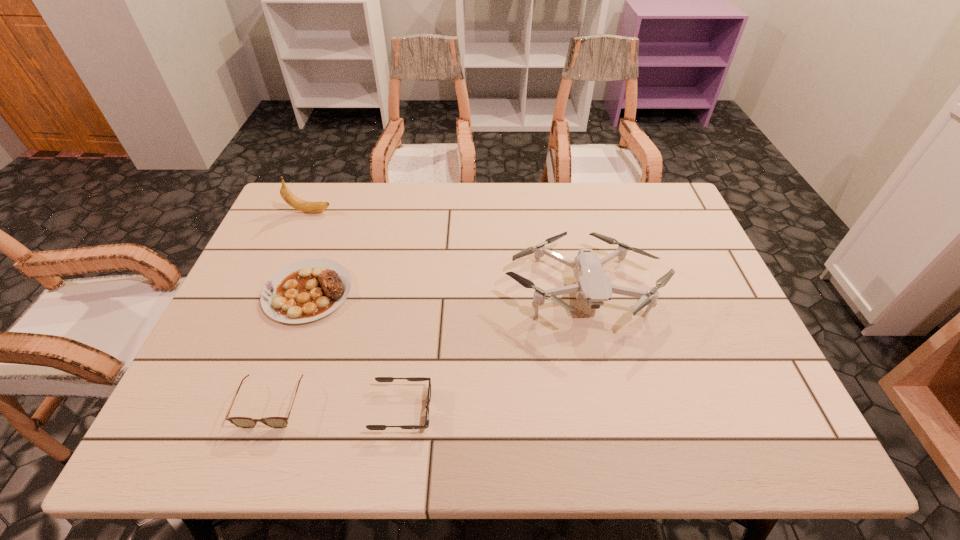
At what (x,y) coordinates should I click in order to perform the action: click on empty space that is in between the fourth shortest object and the second object from right to left. Please return your answer as a coordinate pair (x, y). Looking at the image, I should click on (492, 349).

The height and width of the screenshot is (540, 960). Identify the location of vacant point located between the spectacles and the steak. (290, 348).

Locate an element on the screen. The height and width of the screenshot is (540, 960). vacant area between the drone and the banana is located at coordinates (446, 250).

Where is `free spot between the shortest object and the drone`? Image resolution: width=960 pixels, height=540 pixels. free spot between the shortest object and the drone is located at coordinates (492, 349).

The width and height of the screenshot is (960, 540). What are the coordinates of `unoccupied area between the fourth shortest object and the spectacles` in the screenshot? It's located at (427, 347).

Identify the location of vacant region between the steak and the tallest object. (309, 252).

Identify which object is the fourth nearest to the shortest object. Please provide its 2D coordinates. Your answer should be formatted as a tuple, i.e. [(x, y)], where the tuple contains the x and y coordinates of a point satisfying the conditions above.

[(306, 206)]

The width and height of the screenshot is (960, 540). Find the location of `object that stands as the third closest to the tallest object`. object that stands as the third closest to the tallest object is located at coordinates (243, 422).

At what (x,y) coordinates should I click in order to perform the action: click on free space that satisfies the following two spatial constraints: 1. with a camera at the front of the fourth shortest object; 2. on the temples of the second object from right to left. Please return your answer as a coordinate pair (x, y). Looking at the image, I should click on (609, 409).